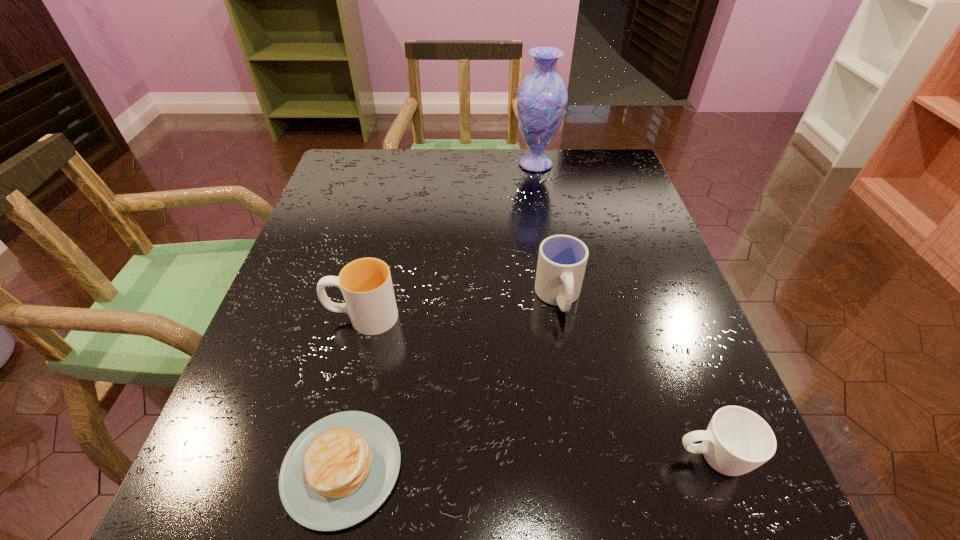
Image resolution: width=960 pixels, height=540 pixels. Find the location of `vacant area between the shortest object and the vase`. vacant area between the shortest object and the vase is located at coordinates (439, 316).

This screenshot has width=960, height=540. What are the coordinates of `unoccupied area between the leftmost cup and the second cup from right to left` in the screenshot? It's located at (461, 307).

Where is `free space between the farthest object and the second cup from right to left`? free space between the farthest object and the second cup from right to left is located at coordinates (547, 231).

At what (x,y) coordinates should I click in order to perform the action: click on vacant point located between the rightmost cup and the second cup from left to right. Please return your answer as a coordinate pair (x, y). This screenshot has height=540, width=960. Looking at the image, I should click on (635, 378).

Where is `vacant area that lies between the farthest object and the second shortest object`? This screenshot has width=960, height=540. vacant area that lies between the farthest object and the second shortest object is located at coordinates (623, 311).

Where is `empty space between the second cup from right to left and the shortest object`? This screenshot has width=960, height=540. empty space between the second cup from right to left and the shortest object is located at coordinates (450, 383).

This screenshot has width=960, height=540. In order to click on free space between the nearest cup and the second cup from left to right in this screenshot , I will do `click(635, 378)`.

Locate which object is the fourth closest to the leftmost cup. Please provide its 2D coordinates. Your answer should be formatted as a tuple, i.e. [(x, y)], where the tuple contains the x and y coordinates of a point satisfying the conditions above.

[(542, 97)]

Identify which object is located as the fourth nearest to the tallest object. Please provide its 2D coordinates. Your answer should be formatted as a tuple, i.e. [(x, y)], where the tuple contains the x and y coordinates of a point satisfying the conditions above.

[(737, 440)]

Identify which cup is the nearest to the vase. Please provide its 2D coordinates. Your answer should be formatted as a tuple, i.e. [(x, y)], where the tuple contains the x and y coordinates of a point satisfying the conditions above.

[(562, 259)]